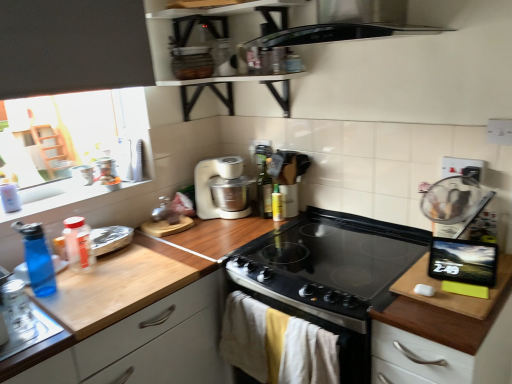
Question: Are wooden cutting board at right and translucent plastic bottle at left, arranged as the second bottle when viewed from the front, located far from each other?

Choices:
 (A) no
 (B) yes

Answer: (B)

Question: From a real-world perspective, is wooden cutting board at right positioned under translucent plastic bottle at left, which appears as the third bottle when viewed from the back, based on gravity?

Choices:
 (A) no
 (B) yes

Answer: (B)

Question: Does wooden cutting board at right turn towards translucent plastic bottle at left, which appears as the 2th bottle when viewed from the left?

Choices:
 (A) yes
 (B) no

Answer: (B)

Question: From the image's perspective, is wooden cutting board at right under translucent plastic bottle at left, arranged as the second bottle when viewed from the front?

Choices:
 (A) no
 (B) yes

Answer: (B)

Question: Does wooden cutting board at right have a lesser height compared to translucent plastic bottle at left, arranged as the second bottle when viewed from the front?

Choices:
 (A) no
 (B) yes

Answer: (A)

Question: Is the position of wooden cutting board at right more distant than that of translucent plastic bottle at left, arranged as the second bottle when viewed from the front?

Choices:
 (A) no
 (B) yes

Answer: (A)

Question: Considering the relative positions of clear glass jar at left and blue translucent bottle at left, the fourth bottle from the back, in the image provided, is clear glass jar at left to the right of blue translucent bottle at left, the fourth bottle from the back, from the viewer's perspective?

Choices:
 (A) yes
 (B) no

Answer: (A)

Question: Could you tell me if clear glass jar at left is turned towards blue translucent bottle at left, the fourth bottle from the back?

Choices:
 (A) no
 (B) yes

Answer: (A)

Question: Is clear glass jar at left looking in the opposite direction of blue translucent bottle at left, the fourth bottle from the back?

Choices:
 (A) no
 (B) yes

Answer: (A)

Question: Are clear glass jar at left and blue translucent bottle at left, placed as the 1th bottle when sorted from left to right, far apart?

Choices:
 (A) no
 (B) yes

Answer: (A)

Question: Considering the relative sizes of clear glass jar at left and blue translucent bottle at left, placed as the first bottle when sorted from front to back, in the image provided, is clear glass jar at left shorter than blue translucent bottle at left, placed as the first bottle when sorted from front to back,?

Choices:
 (A) no
 (B) yes

Answer: (B)

Question: Does clear glass jar at left have a smaller size compared to blue translucent bottle at left, the fourth bottle from the back?

Choices:
 (A) yes
 (B) no

Answer: (A)

Question: Does translucent plastic bottle at left, which appears as the 2th bottle when viewed from the left, appear on the right side of black glass gas stove at center?

Choices:
 (A) yes
 (B) no

Answer: (B)